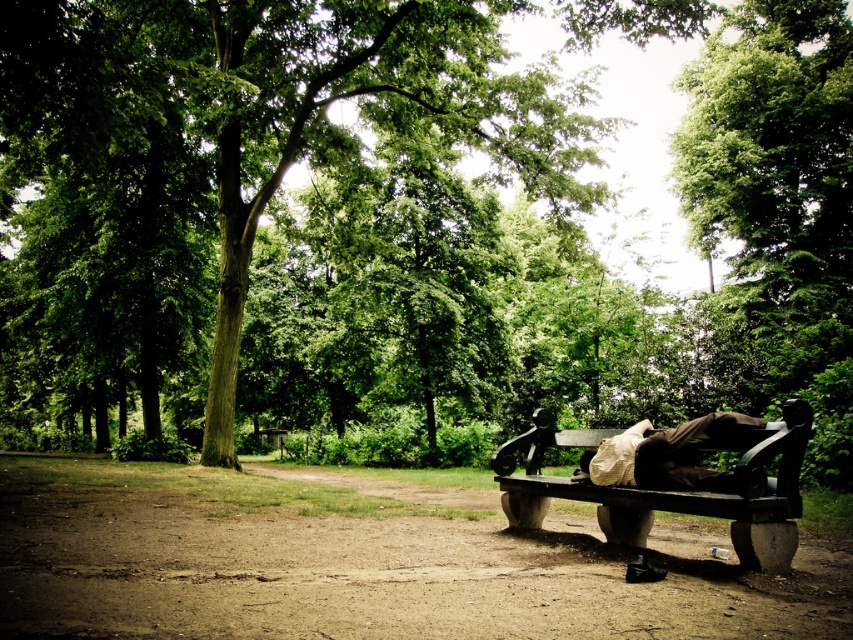
Does point (389, 42) come behind point (726, 513)?

Yes, it is.

Is green leafy tree at center further to camera compared to wooden bench at lower right?

Yes, it is behind wooden bench at lower right.

Is point (416, 193) less distant than point (741, 548)?

That is False.

Locate an element on the screen. This screenshot has width=853, height=640. green leafy tree at center is located at coordinates (399, 230).

Is wooden bench at lower right wider than brown fabric bag at lower right?

Yes.

Does point (643, 509) come closer to viewer compared to point (686, 477)?

No, (643, 509) is behind (686, 477).

Locate an element on the screen. This screenshot has height=640, width=853. wooden bench at lower right is located at coordinates (672, 488).

Does green leafy tree at center appear on the left side of brown fabric bag at lower right?

Correct, you'll find green leafy tree at center to the left of brown fabric bag at lower right.

Does green leafy tree at center have a smaller size compared to brown fabric bag at lower right?

No.

Identify the location of green leafy tree at center. This screenshot has height=640, width=853. (399, 230).

I want to click on green leafy tree at center, so click(399, 230).